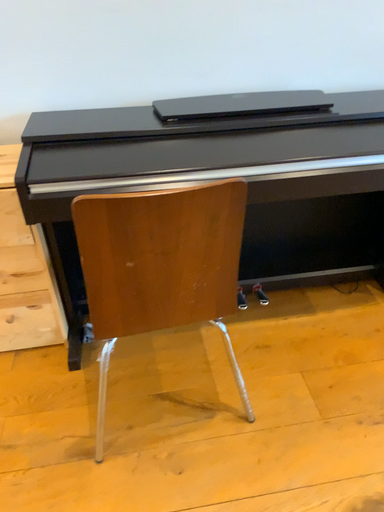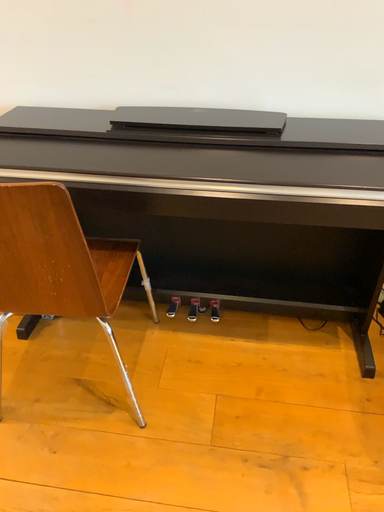
Question: Which way did the camera rotate in the video?

Choices:
 (A) rotated left
 (B) rotated right

Answer: (A)